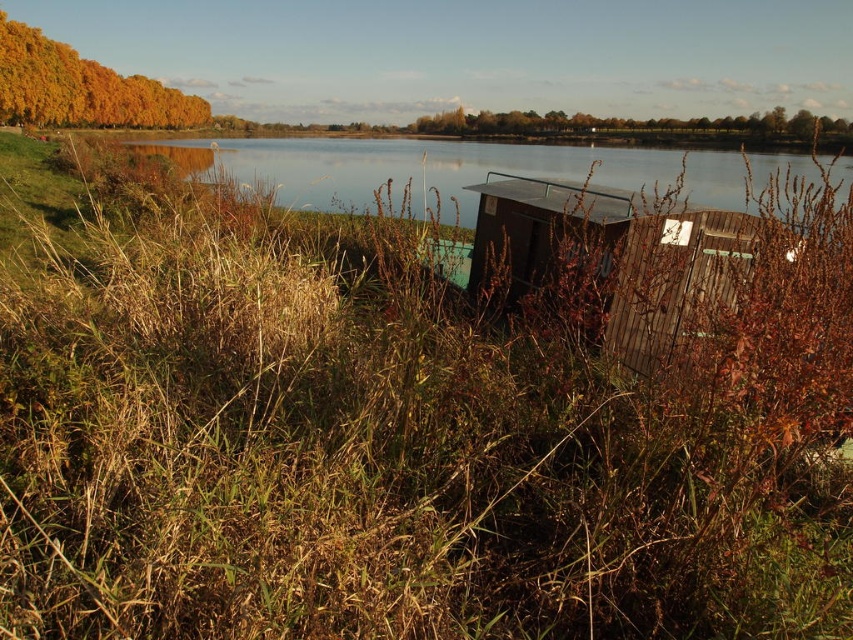
Question: Which point is closer to the camera taking this photo?

Choices:
 (A) tap(424, 125)
 (B) tap(456, 195)
 (C) tap(534, 260)
 (D) tap(76, 84)

Answer: (C)

Question: Does transparent glass water at center have a smaller size compared to golden foliage at upper left?

Choices:
 (A) yes
 (B) no

Answer: (B)

Question: Does wooden shed at center appear on the right side of golden foliage at upper left?

Choices:
 (A) yes
 (B) no

Answer: (A)

Question: Which of these objects is positioned closest to the wooden shed at center?

Choices:
 (A) golden foliage at upper left
 (B) green leafy tree at upper center
 (C) transparent glass water at center

Answer: (C)

Question: Which point is closer to the camera taking this photo?

Choices:
 (A) (416, 208)
 (B) (491, 170)

Answer: (A)

Question: Is wooden shed at center smaller than transparent glass water at center?

Choices:
 (A) yes
 (B) no

Answer: (A)